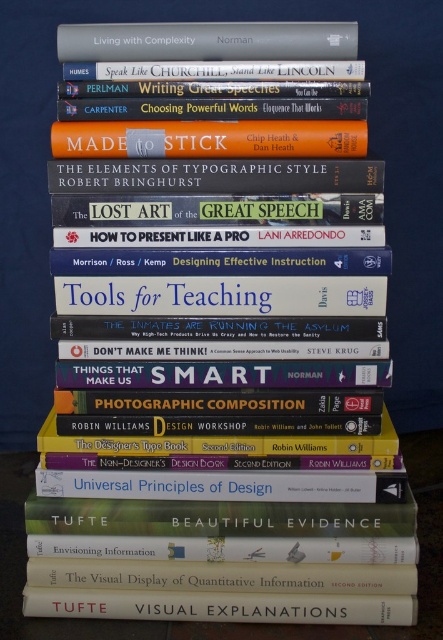
You are an AI analyzing the layout of a book pyramid. The coordinates given are normalized between 0 and 1. The base of the pyramid is at y < 0.5. Is the matte white book at center located above or below the base of the pyramid?

The matte white book at center is located at y coordinate 0.497, which is just below the midpoint of the pyramid. Since the base is defined as y < 0.5, the matte white book at center is positioned within the base of the pyramid.

You are looking at the pyramid of books and want to place a new book on the top. The new book must be placed on the point that is closer to you. Which point should you choose between point (393,620) and point (237,22)?

Point (393,620) is closer to the camera than point (237,22), so you should place the new book on point (393,620).